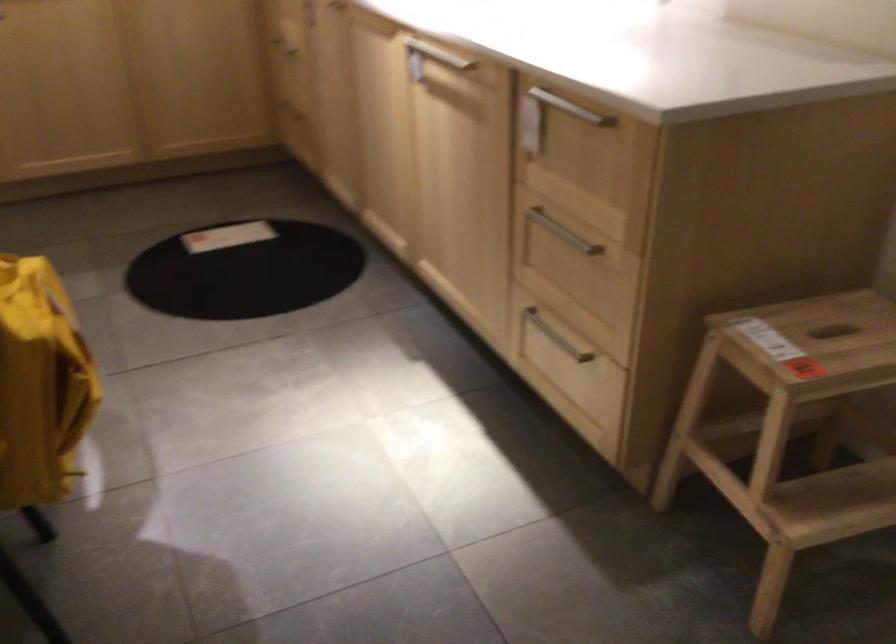
Describe the element at coordinates (739, 527) in the screenshot. This screenshot has width=896, height=644. I see `the step stool handle` at that location.